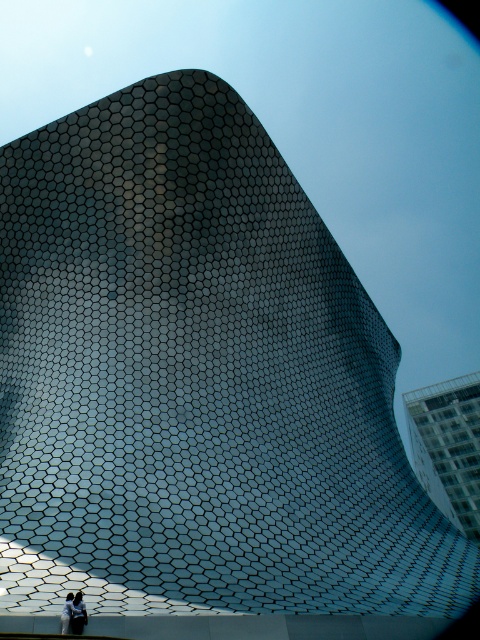
You are a visitor standing at the base of the honeycomb building and see the white fabric person at lower left and the light blue fabric at center. Which object is closer to the ground?

The white fabric person at lower left is below the light blue fabric at center, so it is closer to the ground.

In the scene shown: You are an architect evaluating the building. You notice the white fabric person at lower left and the light blue fabric at center. Which object is taller? Please base your answer on the description provided.

The white fabric person at lower left is taller than the light blue fabric at center according to the description.

You are a photographer planning to take a picture of the architectural structure. You notice the white fabric person at lower left and the light blue fabric at center. Which object should you position closer to the left side of your frame to ensure both are included in the shot?

You should position the light blue fabric at center closer to the left side of your frame because the white fabric person at lower left is to the right of it, ensuring both are included in the shot.